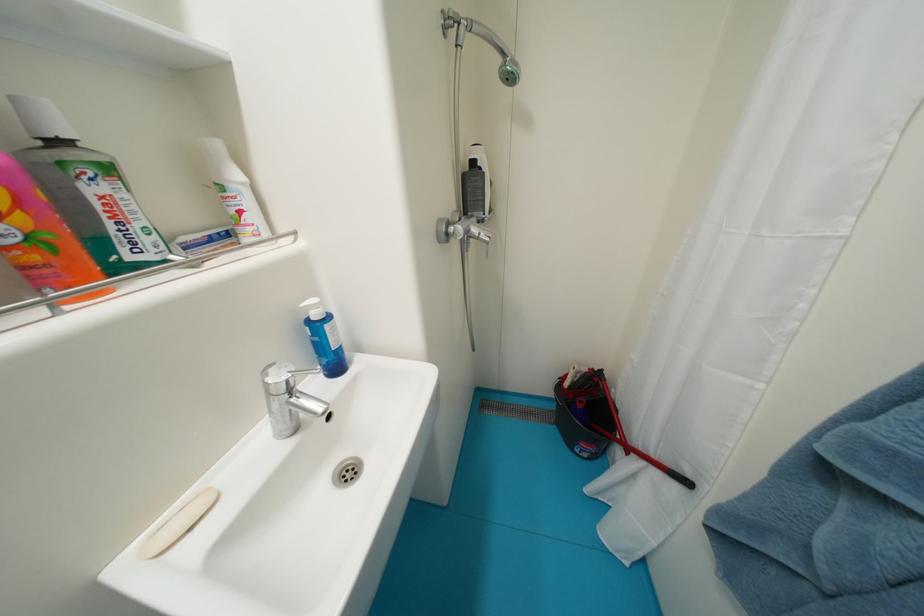
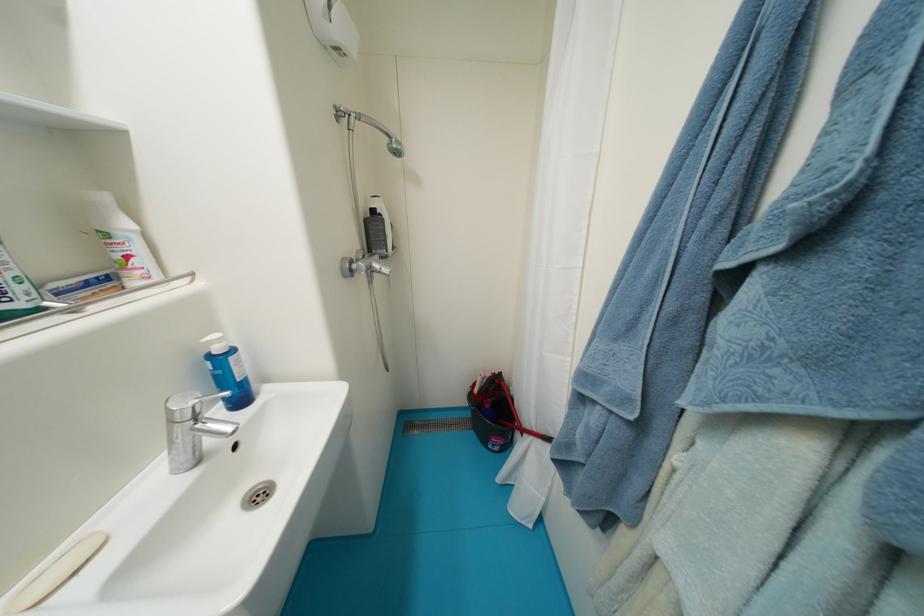
The point at (x=180, y=517) is marked in the first image. Where is the corresponding point in the second image?

(55, 572)